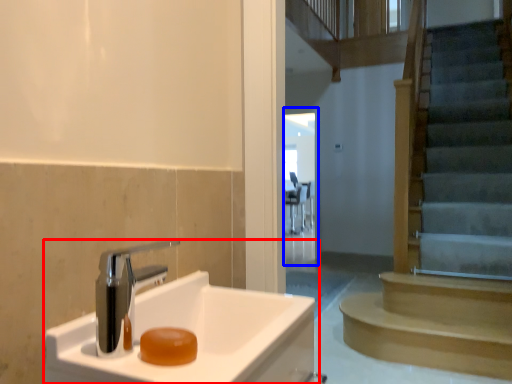
Question: Which point is closer to the camera, sink (highlighted by a red box) or glass door (highlighted by a blue box)?

Choices:
 (A) sink
 (B) glass door

Answer: (A)